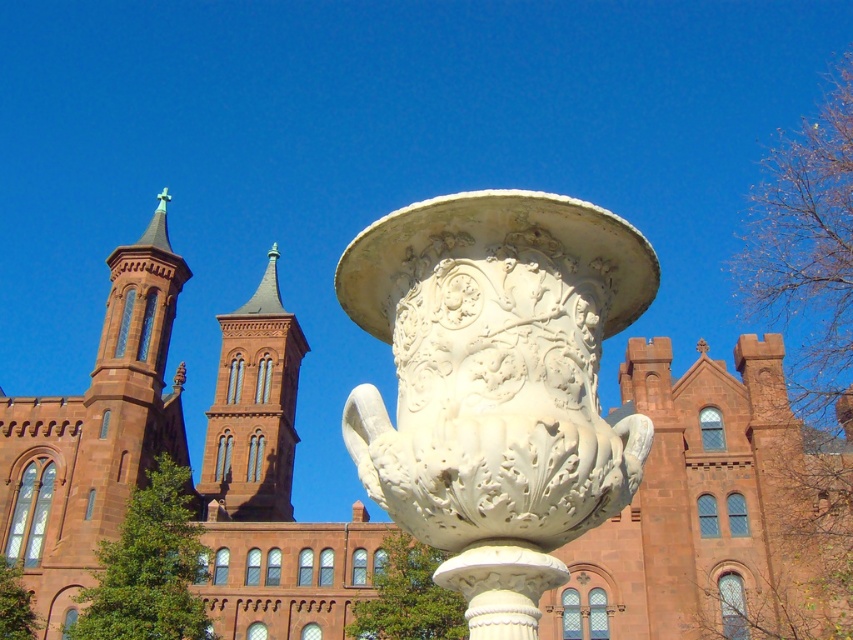
From the picture: Measure the distance from matte stone church at center to white stone vase at center.

matte stone church at center and white stone vase at center are 39.45 meters apart.

Who is more forward, (584, 564) or (466, 250)?

Point (466, 250) is more forward.

Which is in front, point (288, 324) or point (498, 538)?

Point (498, 538) is in front.

You are a GUI agent. You are given a task and a screenshot of the screen. Output one action in this format:
    pyautogui.click(x=<x>, y=<y>)
    Task: Click on the matte stone church at center
    Image resolution: width=853 pixels, height=640 pixels.
    Given the screenshot: What is the action you would take?
    (x=582, y=422)

Between white stone vase at center and red brick tower at center, which one is positioned lower?

red brick tower at center

Between point (579, 349) and point (230, 456), which one is positioned in front?

Point (579, 349) is more forward.

The height and width of the screenshot is (640, 853). Find the location of `white stone vase at center`. white stone vase at center is located at coordinates (496, 385).

Which is more to the right, matte stone church at center or red brick tower at center?

matte stone church at center

Does point (820, 492) lie behind point (294, 332)?

No, it is in front of (294, 332).

Find the location of a particular element. This screenshot has height=640, width=853. matte stone church at center is located at coordinates (582, 422).